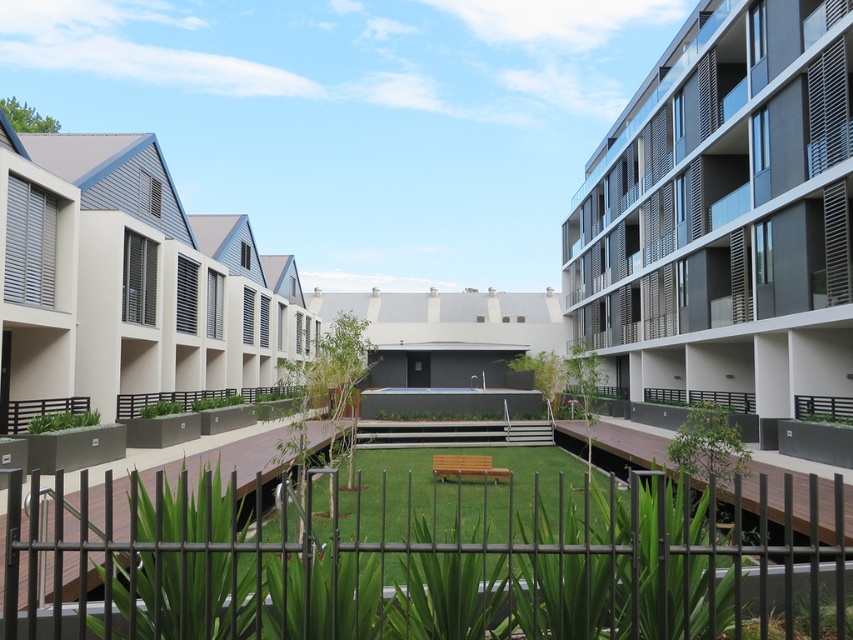
Between black metal fence at center and beige textured building at left, which one has more height?

Standing taller between the two is beige textured building at left.

Who is more forward, (260,490) or (85,328)?

Point (260,490) is more forward.

Between point (62, 561) and point (38, 224), which one is positioned in front?

Point (62, 561) is in front.

I want to click on black metal fence at center, so click(428, 561).

Is black metal fence at center to the right of matte gray building at right from the viewer's perspective?

No, black metal fence at center is not to the right of matte gray building at right.

Measure the distance between black metal fence at center and matte gray building at right.

They are 15.36 meters apart.

Measure the distance between point (105, 586) and camera.

A distance of 2.62 meters exists between point (105, 586) and camera.

Where is `black metal fence at center`? Image resolution: width=853 pixels, height=640 pixels. black metal fence at center is located at coordinates (428, 561).

Can you confirm if matte gray building at right is positioned below beige textured building at left?

No.

Can you confirm if matte gray building at right is positioned to the left of beige textured building at left?

No, matte gray building at right is not to the left of beige textured building at left.

The height and width of the screenshot is (640, 853). Identify the location of matte gray building at right. (724, 218).